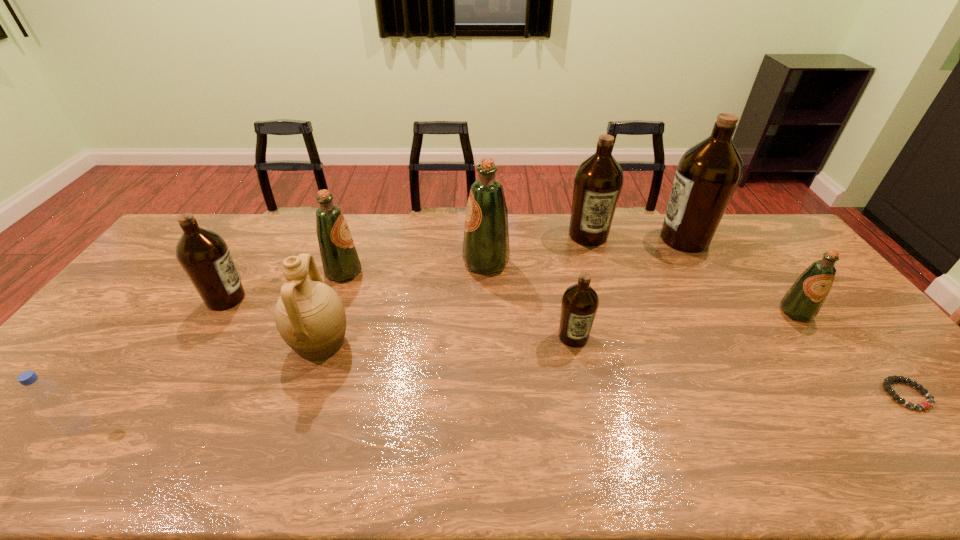
At what (x,y) coordinates should I click in order to perform the action: click on vacant space at the left edge of the desktop. Please return your answer as a coordinate pair (x, y). Looking at the image, I should click on (118, 314).

Identify the location of free location at the right edge of the desktop. This screenshot has width=960, height=540. (754, 253).

Identify the location of vacant space at the far left corner of the desktop. This screenshot has width=960, height=540. (232, 217).

Identify the location of vacant area that lies between the leftmost object and the second smallest green olive oil. Image resolution: width=960 pixels, height=540 pixels. (212, 350).

Find the location of `free spot between the blue bottle and the bracelet`. free spot between the blue bottle and the bracelet is located at coordinates (493, 411).

Where is `vacant area that lies between the second green olive oil from right to left and the nearest green olive oil`? The height and width of the screenshot is (540, 960). vacant area that lies between the second green olive oil from right to left and the nearest green olive oil is located at coordinates (641, 288).

In order to click on vacant point located between the second olive oil from left to right and the nearest brown olive oil in this screenshot , I will do `click(459, 304)`.

Locate an element on the screen. The image size is (960, 540). blank region between the seventh object from left to right and the biggest green olive oil is located at coordinates (537, 249).

Identify the location of blank region between the pitcher and the rightmost olive oil. (558, 328).

Identify the location of free area in between the leftmost olive oil and the black bracelet. (566, 347).